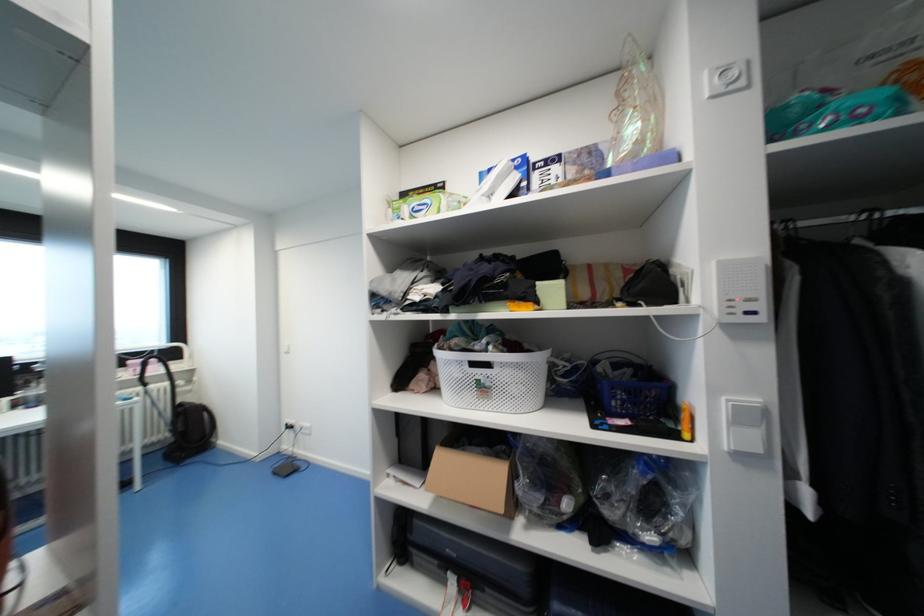
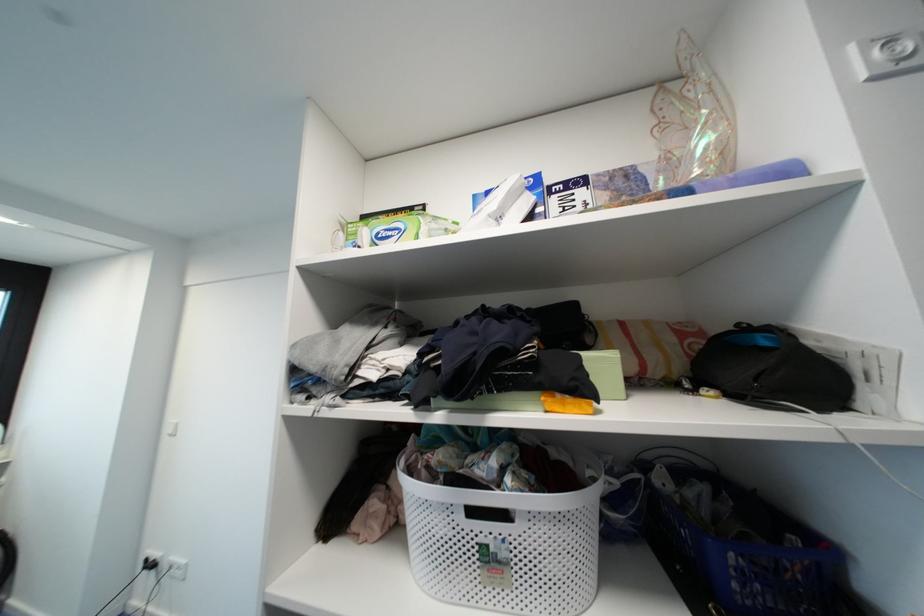
Question: In a continuous first-person perspective shot, in which direction is the camera moving?

Choices:
 (A) Left
 (B) Right
 (C) Forward
 (D) Backward

Answer: (C)